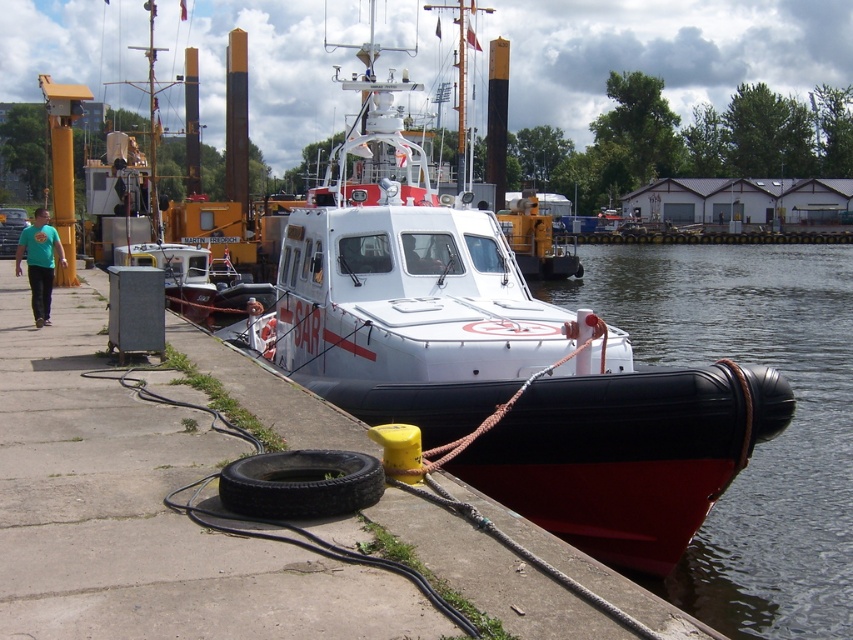
Is black rubber boat at lower right to the right of black rubber tire at lower center from the viewer's perspective?

Correct, you'll find black rubber boat at lower right to the right of black rubber tire at lower center.

Describe the element at coordinates (756, 444) in the screenshot. The image size is (853, 640). I see `black rubber boat at lower right` at that location.

Is point (614, 296) behind point (230, 502)?

Yes.

Find the location of a particular element. black rubber boat at lower right is located at coordinates (756, 444).